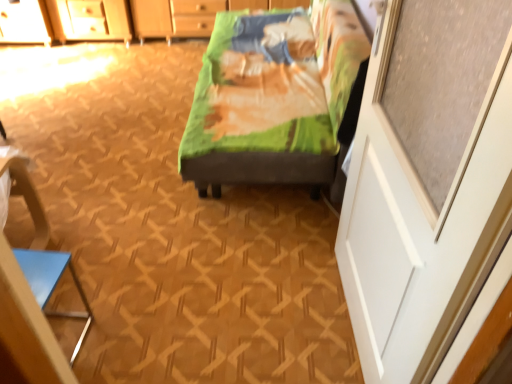
Where is `free location to the right of blue glossy triangle at lower left`? free location to the right of blue glossy triangle at lower left is located at coordinates (112, 337).